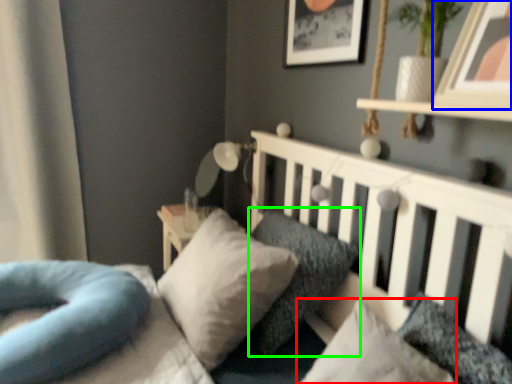
Question: Estimate the real-world distances between objects in this image. Which object is farther from pillow (highlighted by a red box), picture frame (highlighted by a blue box) or pillow (highlighted by a green box)?

Choices:
 (A) picture frame
 (B) pillow

Answer: (A)